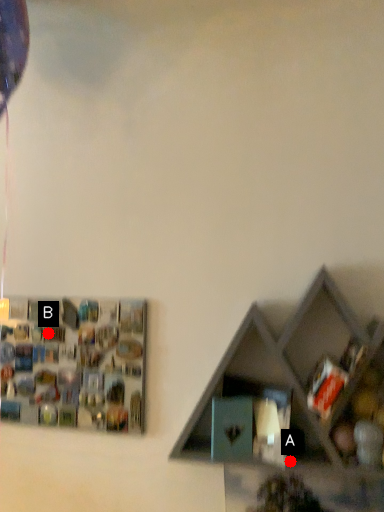
Question: Two points are circled on the image, labeled by A and B beside each circle. Which of the following is the farthest from the observer?

Choices:
 (A) A is further
 (B) B is further

Answer: (B)